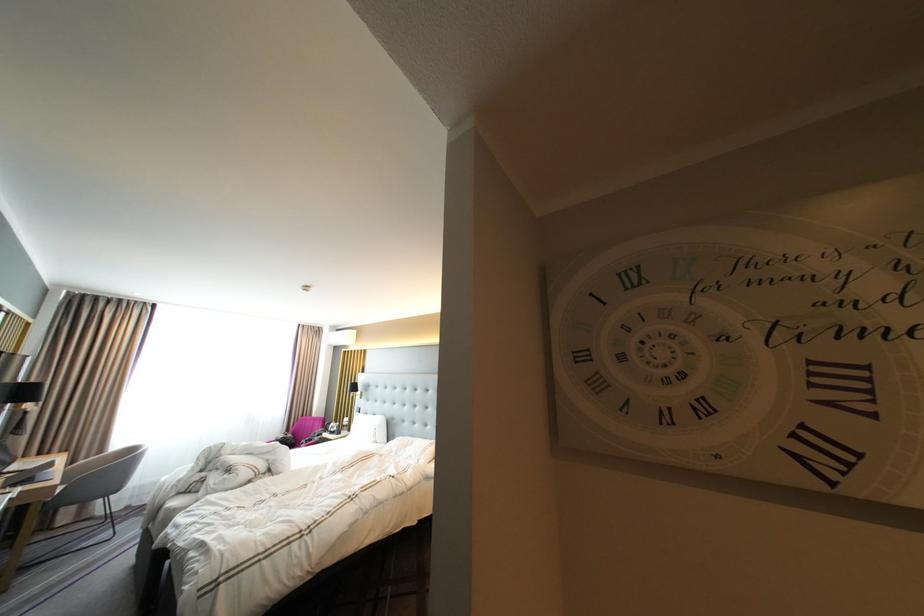
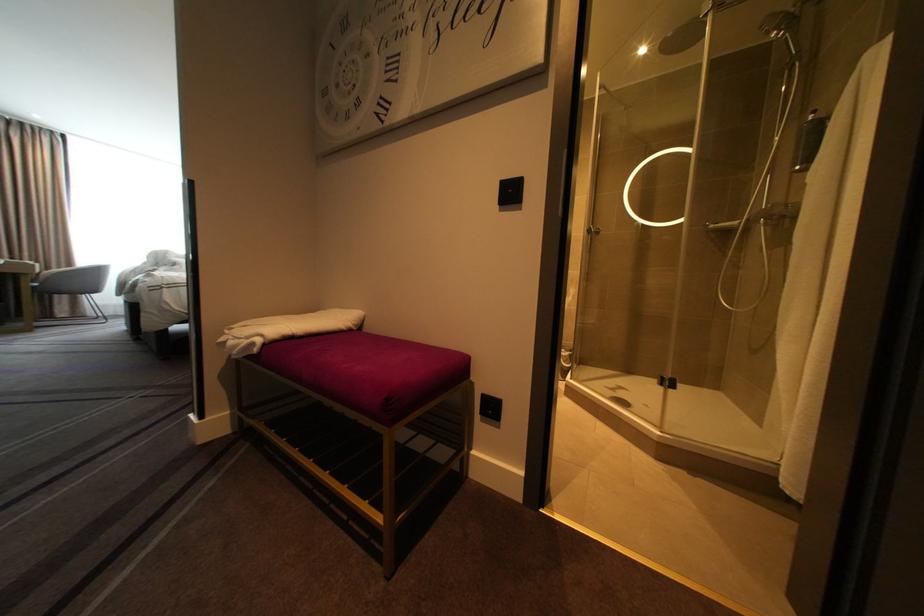
What movement of the cameraman would produce the second image?

The movement direction of the cameraman is right, backward.